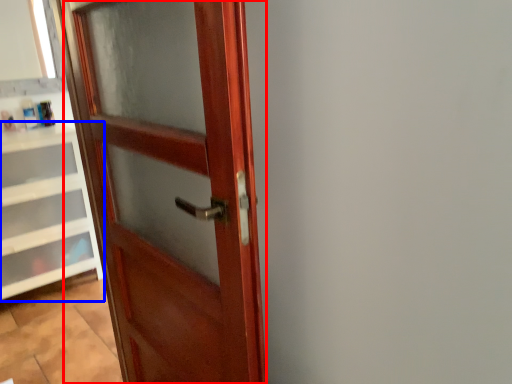
Question: Which object appears farthest to the camera in this image, door (highlighted by a red box) or cabinetry (highlighted by a blue box)?

Choices:
 (A) door
 (B) cabinetry

Answer: (B)